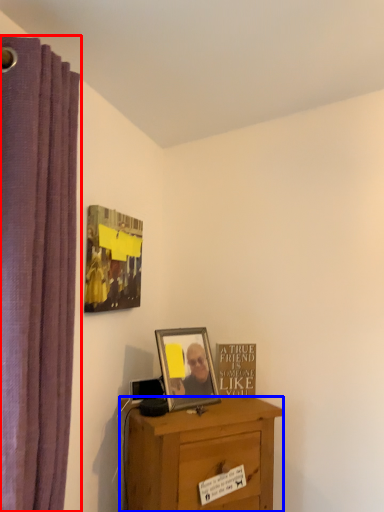
Question: Which object is further to the camera taking this photo, curtain (highlighted by a red box) or desk (highlighted by a blue box)?

Choices:
 (A) curtain
 (B) desk

Answer: (B)